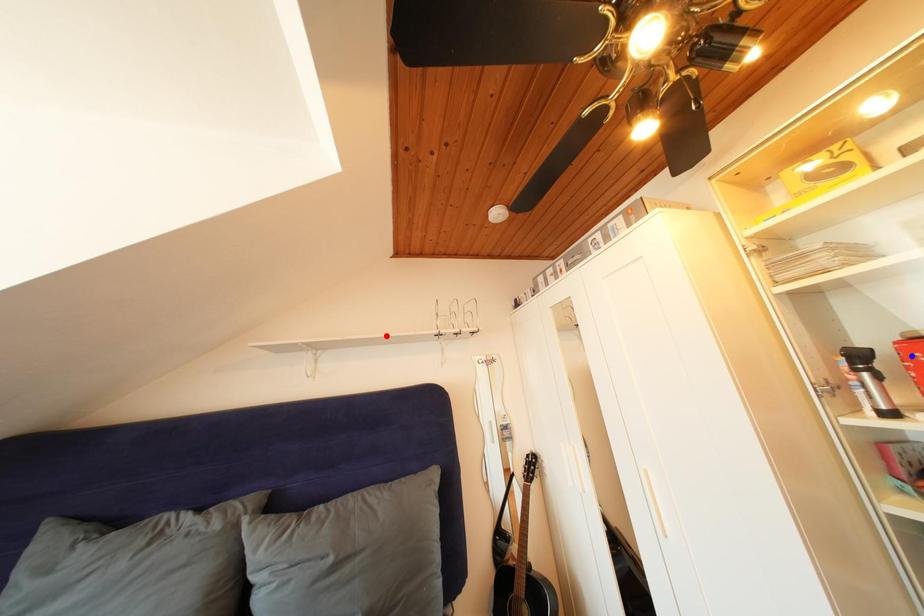
Question: Two points are marked on the image. Which point is closer to the camera?

Choices:
 (A) Blue point is closer.
 (B) Red point is closer.

Answer: (A)